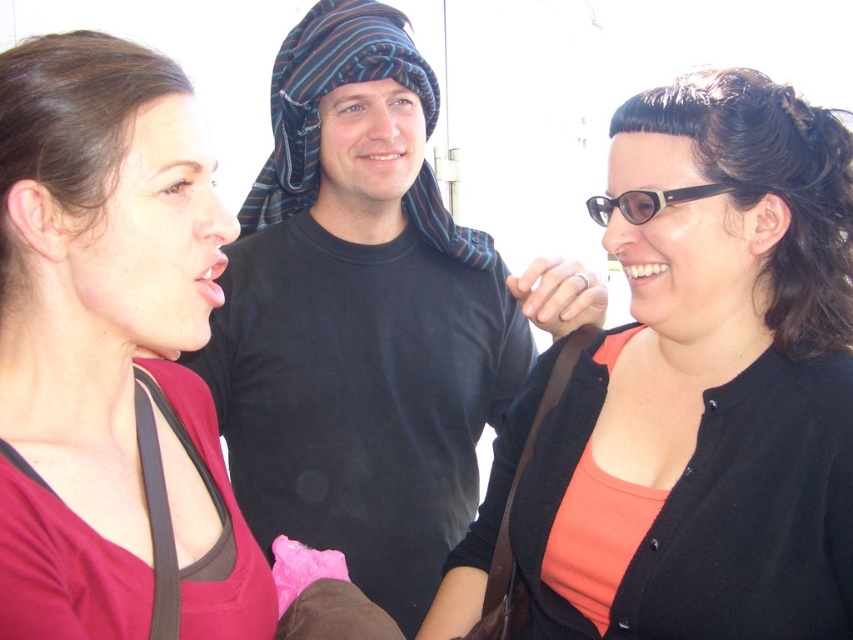
At what (x,y) coordinates should I click in order to perform the action: click on matte black cardigan at center. Please return your answer as a coordinate pair (x, y). Looking at the image, I should click on (708, 387).

Does matte black cardigan at center have a smaller size compared to black cotton shirt at center?

Yes.

This screenshot has width=853, height=640. Describe the element at coordinates (708, 387) in the screenshot. I see `matte black cardigan at center` at that location.

Image resolution: width=853 pixels, height=640 pixels. In order to click on matte black cardigan at center in this screenshot , I will do `click(708, 387)`.

Can you confirm if black cotton shirt at center is positioned above matte red shirt at left?

Yes.

Looking at this image, does black cotton shirt at center appear on the right side of matte red shirt at left?

Correct, you'll find black cotton shirt at center to the right of matte red shirt at left.

Is point (329, 77) behind point (19, 432)?

Yes, it is.

At what (x,y) coordinates should I click in order to perform the action: click on black cotton shirt at center. Please return your answer as a coordinate pair (x, y). Image resolution: width=853 pixels, height=640 pixels. Looking at the image, I should click on (367, 317).

Can you confirm if black cotton shirt at center is positioned to the left of black plastic glasses at upper right?

Indeed, black cotton shirt at center is positioned on the left side of black plastic glasses at upper right.

Can you confirm if black cotton shirt at center is smaller than black plastic glasses at upper right?

Incorrect, black cotton shirt at center is not smaller in size than black plastic glasses at upper right.

Image resolution: width=853 pixels, height=640 pixels. What are the coordinates of `black cotton shirt at center` in the screenshot? It's located at (367, 317).

The height and width of the screenshot is (640, 853). I want to click on black cotton shirt at center, so click(x=367, y=317).